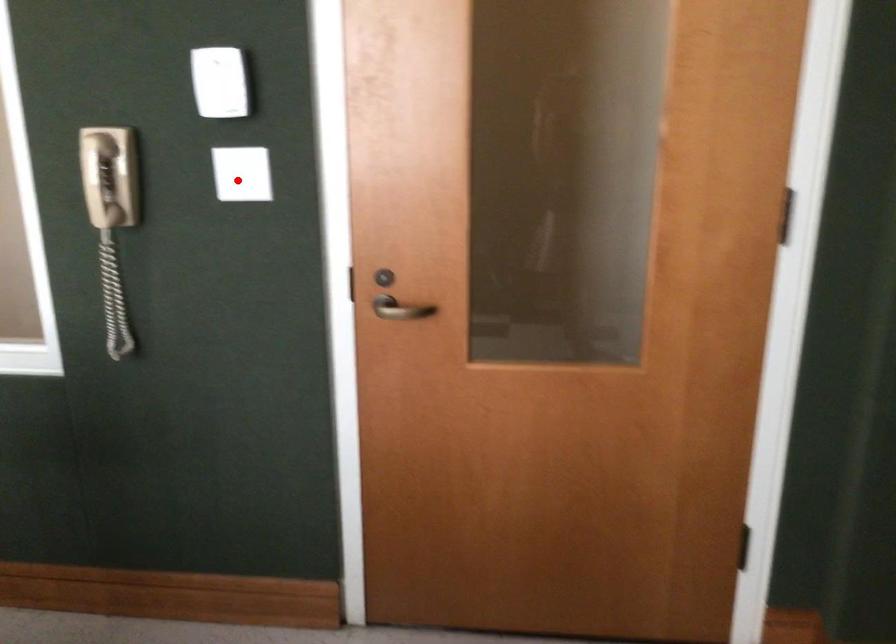
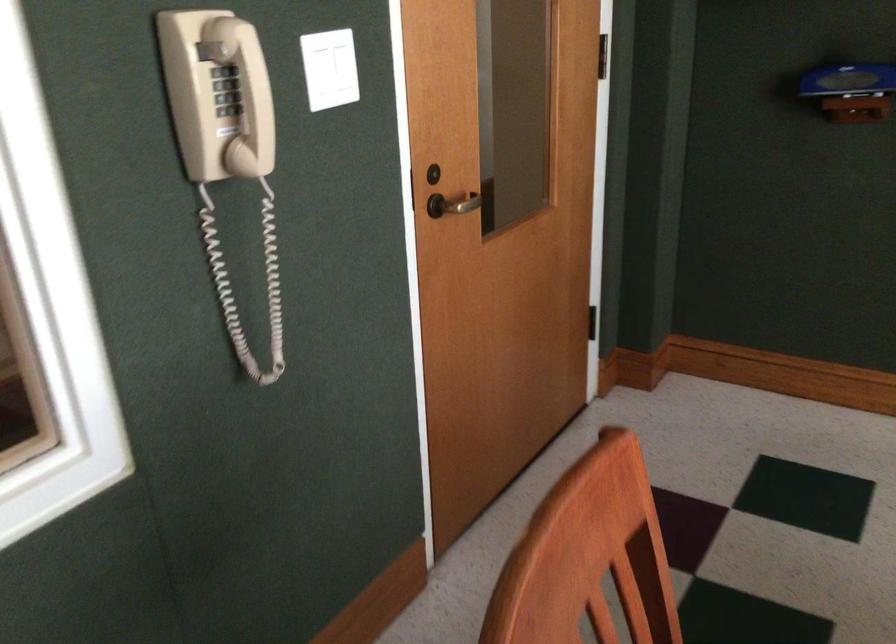
In the second image, find the point that corresponds to the highlighted location in the first image.

(330, 69)